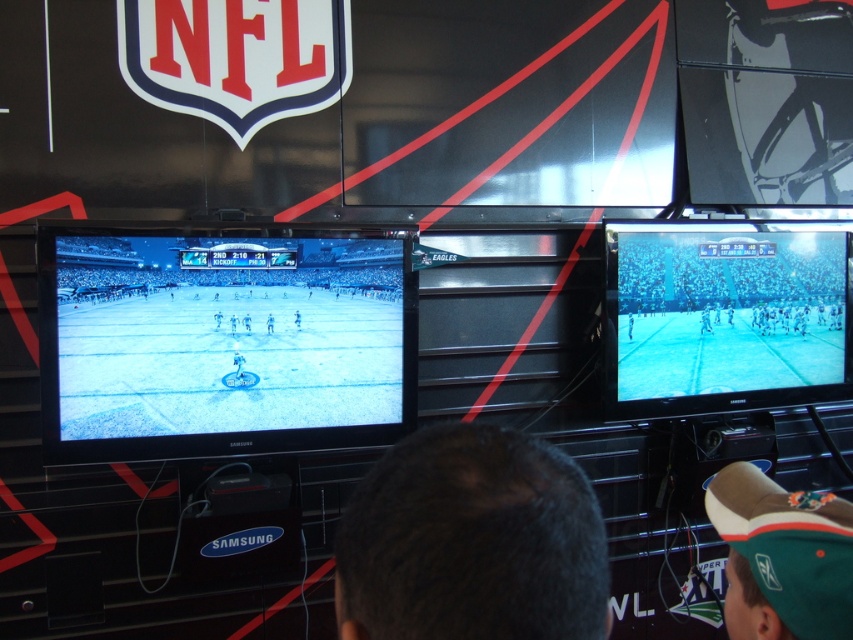
Question: Which point is closer to the camera?

Choices:
 (A) (234, 317)
 (B) (68, 346)

Answer: (B)

Question: Is matte black monitor at left to the left of matte black television at right from the viewer's perspective?

Choices:
 (A) no
 (B) yes

Answer: (B)

Question: Can you confirm if matte black monitor at left is smaller than white glossy figure at center?

Choices:
 (A) no
 (B) yes

Answer: (A)

Question: Is matte black television at right bigger than white glossy figure at center?

Choices:
 (A) no
 (B) yes

Answer: (B)

Question: Which is nearer to the dark hair at center?

Choices:
 (A) white glossy figure at center
 (B) white matte figure at center

Answer: (A)

Question: Estimate the real-world distances between objects in this image. Which object is closer to the matte black television at right?

Choices:
 (A) green fabric cap at lower right
 (B) matte black monitor at left
 (C) dark hair at center

Answer: (B)